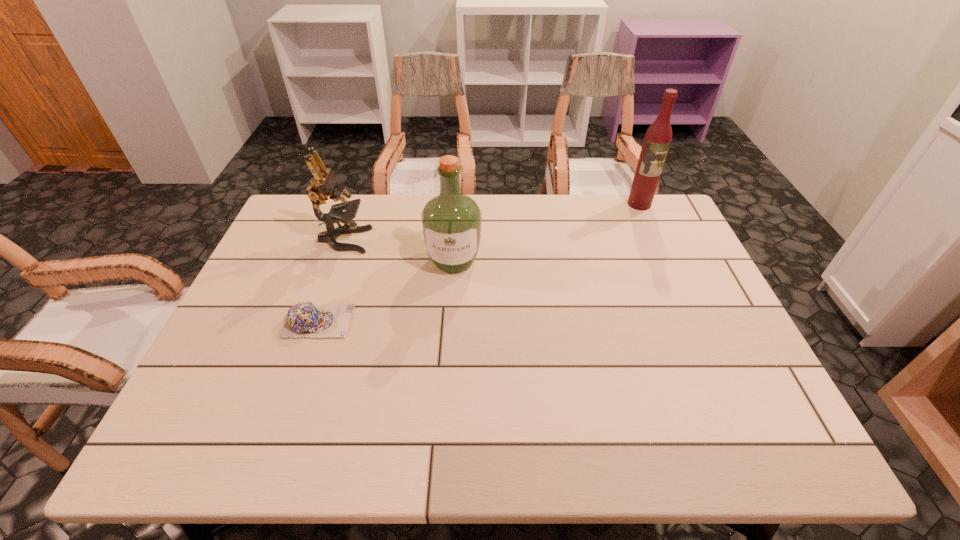
The image size is (960, 540). What are the coordinates of `vacant area between the right liquor and the microscope` in the screenshot? It's located at (492, 222).

Find the location of a particular element. free space between the cap and the second object from right to left is located at coordinates (386, 291).

Find the location of a particular element. This screenshot has height=540, width=960. free space between the cap and the microscope is located at coordinates (331, 281).

Where is `object identified as the second closest to the nearer liquor`? The image size is (960, 540). object identified as the second closest to the nearer liquor is located at coordinates (304, 319).

You are a GUI agent. You are given a task and a screenshot of the screen. Output one action in this format:
    pyautogui.click(x=<x>, y=<y>)
    Task: Click on the second closest object to the microscope
    This screenshot has width=960, height=540.
    Given the screenshot: What is the action you would take?
    pyautogui.click(x=304, y=319)

Where is `vacant space that satisfies the following two spatial constraints: 1. on the front-facing side of the nearer liquor; 2. on the front, side, and top of the cap`? vacant space that satisfies the following two spatial constraints: 1. on the front-facing side of the nearer liquor; 2. on the front, side, and top of the cap is located at coordinates (450, 321).

The height and width of the screenshot is (540, 960). Find the location of `vacant area that satisfies the following two spatial constraints: 1. on the front-facing side of the left liquor; 2. on the front, side, and top of the shortest object`. vacant area that satisfies the following two spatial constraints: 1. on the front-facing side of the left liquor; 2. on the front, side, and top of the shortest object is located at coordinates (450, 321).

Identify the location of free location that satisfies the following two spatial constraints: 1. on the front-facing side of the third object from left to right; 2. on the front, side, and top of the nearest object. click(450, 321).

This screenshot has height=540, width=960. What are the coordinates of `vacant region that satisfies the following two spatial constraints: 1. on the label of the right liquor; 2. at the eyepieces of the microscope` in the screenshot? It's located at (656, 240).

You are a GUI agent. You are given a task and a screenshot of the screen. Output one action in this format:
    pyautogui.click(x=<x>, y=<y>)
    Task: Click on the vacant space that satisfies the following two spatial constraints: 1. on the front-facing side of the left liquor; 2. on the front, side, and top of the nearest object
    This screenshot has width=960, height=540.
    Given the screenshot: What is the action you would take?
    pyautogui.click(x=450, y=321)